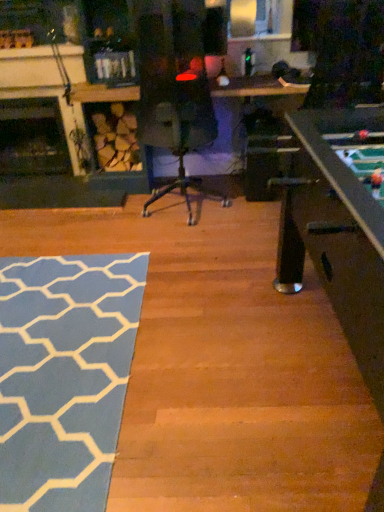
Question: Is dark wood fireplace at left, which is counted as the 1th fireplace, starting from the back, further to the viewer compared to blue textured rug at lower left?

Choices:
 (A) yes
 (B) no

Answer: (A)

Question: Is dark wood fireplace at left, acting as the 2th fireplace starting from the front, smaller than blue textured rug at lower left?

Choices:
 (A) no
 (B) yes

Answer: (A)

Question: Are dark wood fireplace at left, acting as the 2th fireplace starting from the front, and blue textured rug at lower left beside each other?

Choices:
 (A) yes
 (B) no

Answer: (B)

Question: Does dark wood fireplace at left, which is counted as the 1th fireplace, starting from the back, appear on the right side of blue textured rug at lower left?

Choices:
 (A) no
 (B) yes

Answer: (A)

Question: Is dark wood fireplace at left, which is counted as the 1th fireplace, starting from the back, far away from blue textured rug at lower left?

Choices:
 (A) no
 (B) yes

Answer: (B)

Question: In terms of width, does blue textured rug at lower left look wider or thinner when compared to dark wood fireplace at left, the 2th fireplace viewed from the back?

Choices:
 (A) wide
 (B) thin

Answer: (A)

Question: From a real-world perspective, relative to dark wood fireplace at left, the first fireplace when ordered from front to back, is blue textured rug at lower left vertically above or below?

Choices:
 (A) below
 (B) above

Answer: (A)

Question: Visually, is blue textured rug at lower left positioned to the left or to the right of dark wood fireplace at left, the first fireplace when ordered from front to back?

Choices:
 (A) left
 (B) right

Answer: (B)

Question: Considering the positions of blue textured rug at lower left and dark wood fireplace at left, the first fireplace when ordered from front to back, in the image, is blue textured rug at lower left bigger or smaller than dark wood fireplace at left, the first fireplace when ordered from front to back,?

Choices:
 (A) big
 (B) small

Answer: (B)

Question: From a real-world perspective, is dark wood fireplace at left, which is counted as the 1th fireplace, starting from the back, physically located above or below dark wood fireplace at left, the 2th fireplace viewed from the back?

Choices:
 (A) above
 (B) below

Answer: (B)

Question: Considering their positions, is dark wood fireplace at left, acting as the 2th fireplace starting from the front, located in front of or behind dark wood fireplace at left, the first fireplace when ordered from front to back?

Choices:
 (A) front
 (B) behind

Answer: (B)

Question: Would you say dark wood fireplace at left, acting as the 2th fireplace starting from the front, is inside or outside dark wood fireplace at left, the first fireplace when ordered from front to back?

Choices:
 (A) outside
 (B) inside

Answer: (A)

Question: Looking at the image, does dark wood fireplace at left, acting as the 2th fireplace starting from the front, seem bigger or smaller compared to dark wood fireplace at left, the 2th fireplace viewed from the back?

Choices:
 (A) big
 (B) small

Answer: (A)

Question: From a real-world perspective, is dark wood fireplace at left, the first fireplace when ordered from front to back, physically located above or below dark wood fireplace at left, which is counted as the 1th fireplace, starting from the back?

Choices:
 (A) below
 (B) above

Answer: (B)

Question: Considering the relative positions of dark wood fireplace at left, the 2th fireplace viewed from the back, and dark wood fireplace at left, acting as the 2th fireplace starting from the front, in the image provided, is dark wood fireplace at left, the 2th fireplace viewed from the back, to the left or to the right of dark wood fireplace at left, acting as the 2th fireplace starting from the front,?

Choices:
 (A) left
 (B) right

Answer: (B)